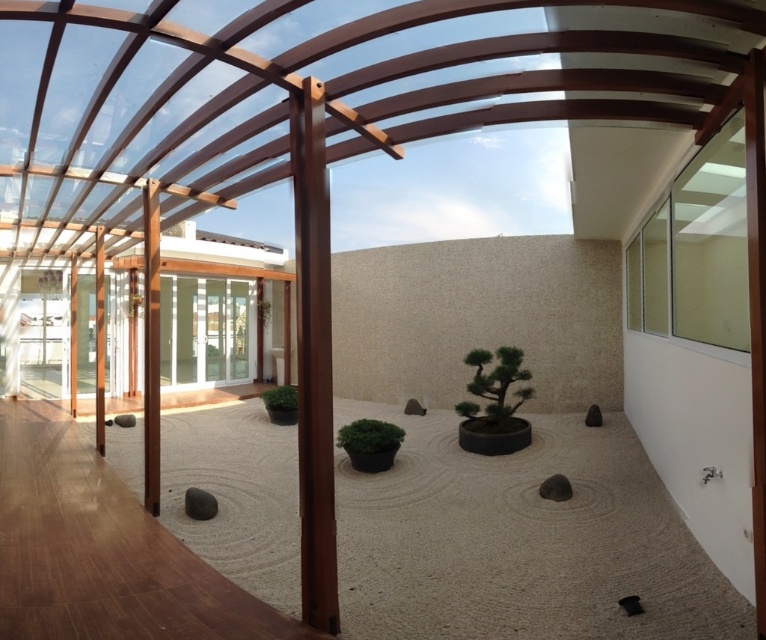
Is green matte bonsai at center shorter than green matte plant at center?

Incorrect, green matte bonsai at center's height does not fall short of green matte plant at center's.

Locate an element on the screen. green matte bonsai at center is located at coordinates (498, 380).

Locate an element on the screen. The image size is (766, 640). green matte bonsai at center is located at coordinates (498, 380).